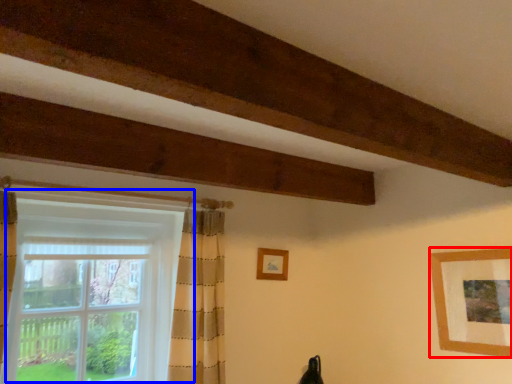
Question: Which object appears farthest to the camera in this image, picture frame (highlighted by a red box) or window (highlighted by a blue box)?

Choices:
 (A) picture frame
 (B) window

Answer: (A)